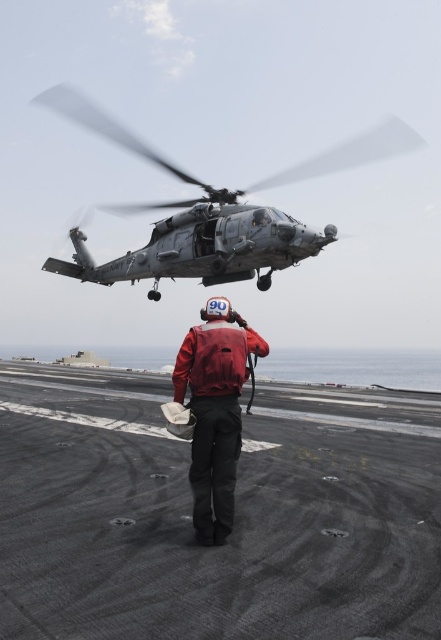
Question: Can you confirm if dark gray metallic helicopter at upper center is positioned below red fabric jacket at center?

Choices:
 (A) yes
 (B) no

Answer: (B)

Question: Does dark gray metallic helicopter at upper center come in front of red matte jacket at center?

Choices:
 (A) no
 (B) yes

Answer: (A)

Question: Which of the following is the closest to the observer?

Choices:
 (A) red matte jacket at center
 (B) dark gray metallic helicopter at upper center

Answer: (A)

Question: Estimate the real-world distances between objects in this image. Which object is closer to the dark gray metallic helicopter at upper center?

Choices:
 (A) red fabric jacket at center
 (B) red matte jacket at center

Answer: (A)

Question: In this image, where is dark gray metallic helicopter at upper center located relative to red fabric jacket at center?

Choices:
 (A) left
 (B) right

Answer: (A)

Question: Among these points, which one is farthest from the camera?

Choices:
 (A) (288, 252)
 (B) (219, 384)
 (C) (213, 307)

Answer: (A)